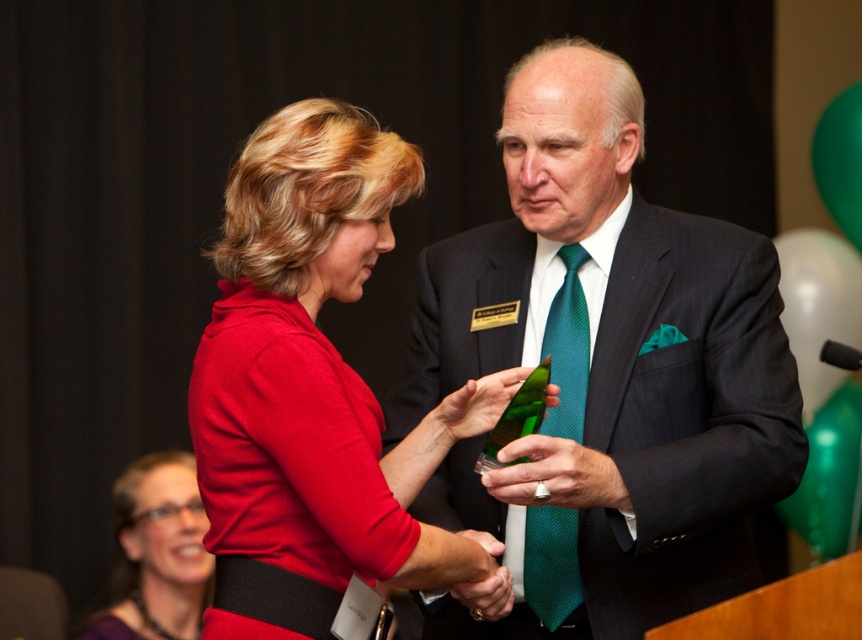
The image size is (862, 640). What do you see at coordinates (603, 376) in the screenshot? I see `matte black suit at center` at bounding box center [603, 376].

Which is more to the right, matte black suit at center or green silk tie at center?

From the viewer's perspective, matte black suit at center appears more on the right side.

Does point (573, 538) come in front of point (567, 310)?

Yes, it is in front of point (567, 310).

Identify the location of matte black suit at center. (603, 376).

Locate an element on the screen. purple fabric dress at lower left is located at coordinates (155, 554).

Between point (117, 502) and point (582, 612), which one is positioned behind?

Point (117, 502)

Is point (197, 579) closer to viewer compared to point (572, 538)?

No, it is not.

Image resolution: width=862 pixels, height=640 pixels. What are the coordinates of `purple fabric dress at lower left` in the screenshot? It's located at (155, 554).

Which is above, matte black suit at center or matte red dress at center?

Positioned higher is matte black suit at center.

Is matte black suit at center positioned before matte red dress at center?

No, matte black suit at center is further to the viewer.

Is point (711, 557) more distant than point (348, 195)?

That is True.

At what (x,y) coordinates should I click in order to perform the action: click on matte black suit at center. Please return your answer as a coordinate pair (x, y). The height and width of the screenshot is (640, 862). Looking at the image, I should click on (603, 376).